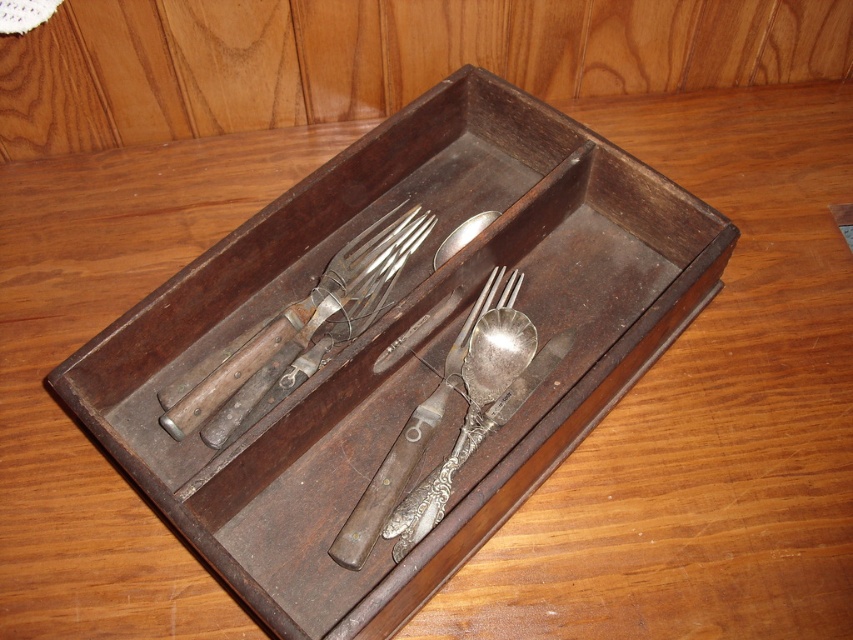
You are arranging items on a table and need to place a decorative vase to the right of the wooden tray at center. Where should the vase be placed relative to the polished silver spoon at center?

The wooden tray at center is on the left side of the polished silver spoon at center. To place the vase to the right of the wooden tray at center, it should be placed to the right of the wooden tray at center, which is the same side as the polished silver spoon at center.